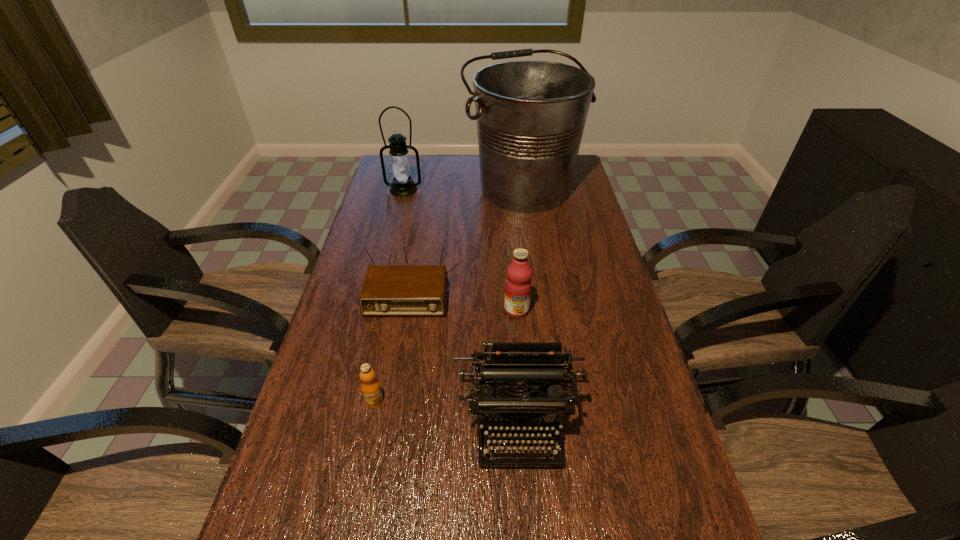
At what (x,y) coordinates should I click in order to perform the action: click on object that can be found as the second closest to the tallest object. Please return your answer as a coordinate pair (x, y). The image size is (960, 540). Looking at the image, I should click on (388, 290).

I want to click on the fourth closest object relative to the bucket, so [505, 363].